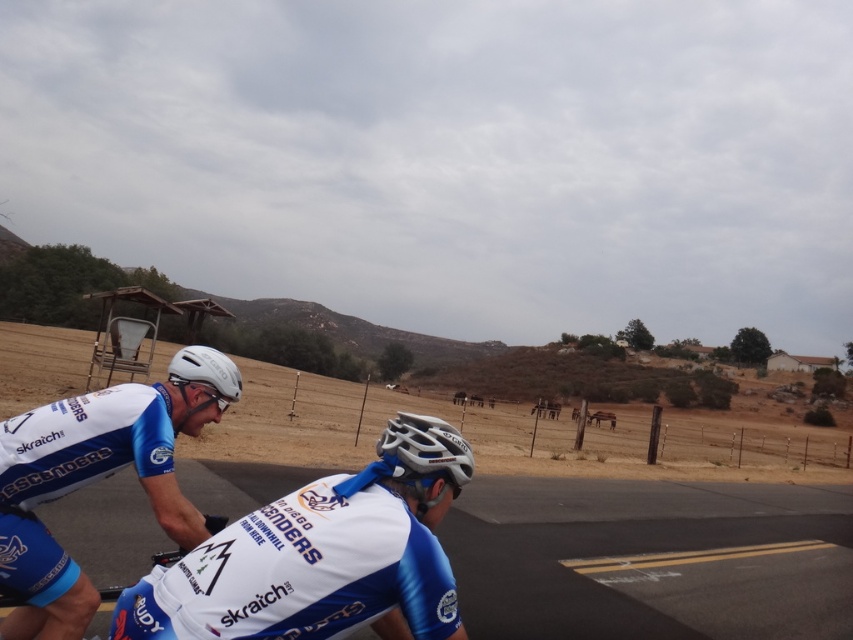
Does white matte helmet at upper center appear under white matte helmet at upper left?

Yes.

The width and height of the screenshot is (853, 640). What do you see at coordinates (322, 556) in the screenshot?
I see `white matte helmet at upper center` at bounding box center [322, 556].

The image size is (853, 640). What do you see at coordinates (322, 556) in the screenshot? I see `white matte helmet at upper center` at bounding box center [322, 556].

What are the coordinates of `white matte helmet at upper center` in the screenshot? It's located at (322, 556).

Does point (235, 385) lie in front of point (218, 371)?

No, it is behind (218, 371).

Where is `white glossy helmet at upper left`? The image size is (853, 640). white glossy helmet at upper left is located at coordinates (97, 480).

Does white glossy helmet at upper left have a lesser height compared to white matte bicycle helmet at center?

No.

Is white glossy helmet at upper left bigger than white matte bicycle helmet at center?

Correct, white glossy helmet at upper left is larger in size than white matte bicycle helmet at center.

Between point (80, 461) and point (468, 449), which one is positioned behind?

Point (80, 461)

The image size is (853, 640). In order to click on white glossy helmet at upper left in this screenshot , I will do `click(97, 480)`.